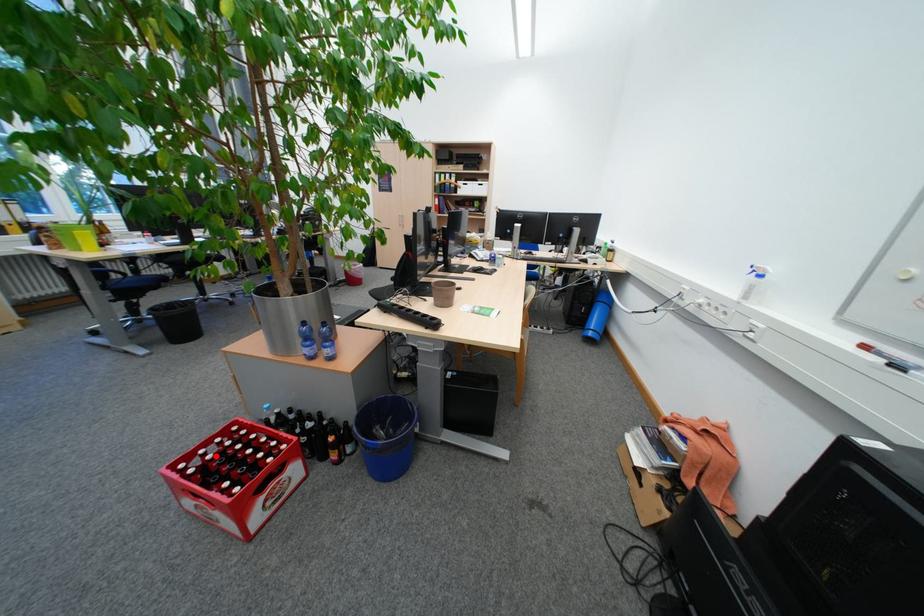
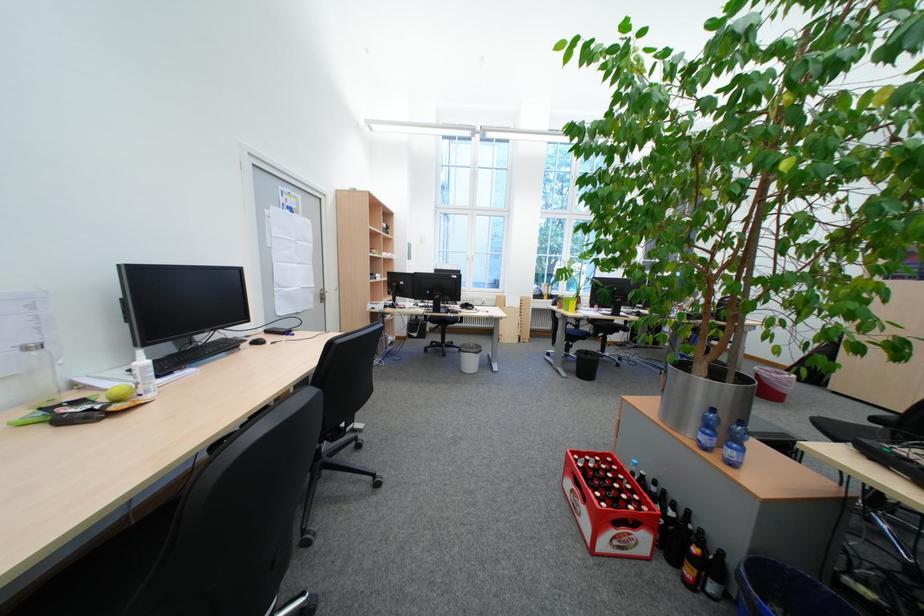
Question: I am providing you with two images of the same scene from different viewpoints. A red point is shown in image1. For the corresponding object point in image2, is it positioned nearer or farther from the camera?

Choices:
 (A) Nearer
 (B) Farther

Answer: (A)